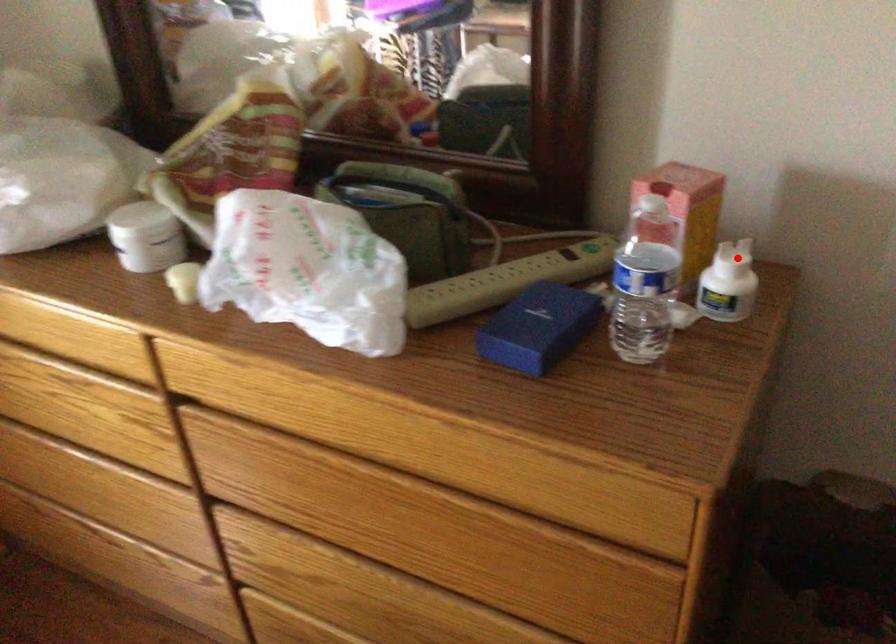
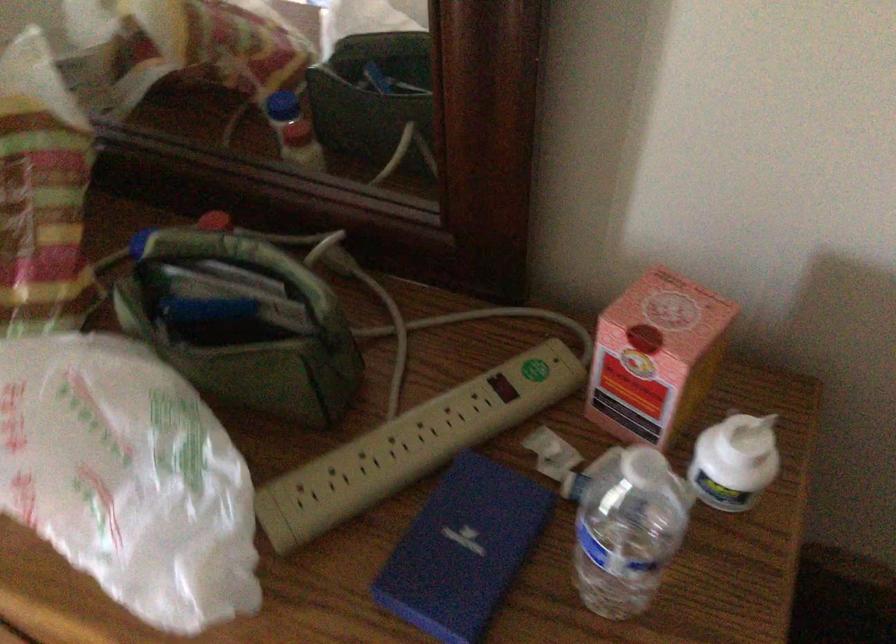
Where in the second image is the point corresponding to the highlighted location from the first image?

(754, 435)